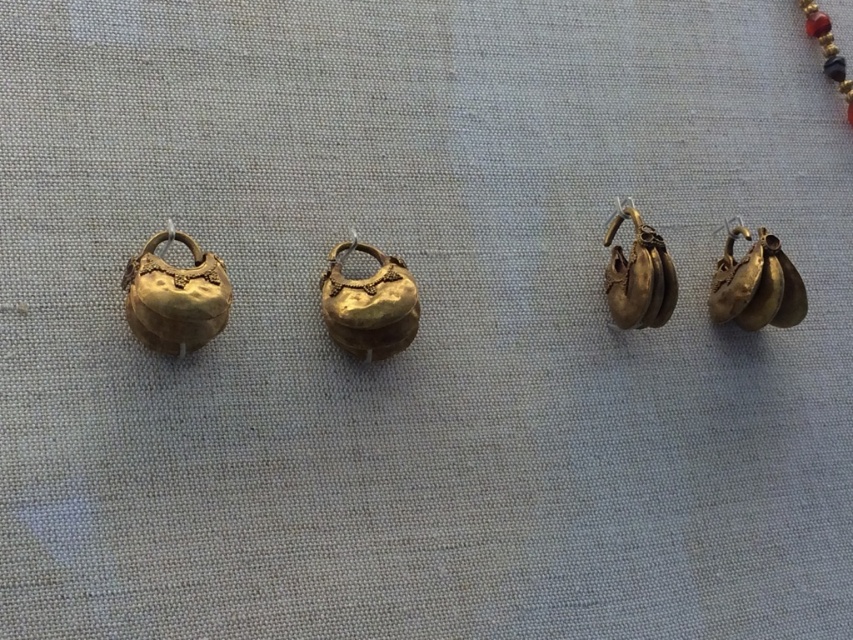
Question: Which object appears farthest from the camera in this image?

Choices:
 (A) gold beaded necklace at upper right
 (B) gold shiny earrings at right

Answer: (A)

Question: Does gold shiny bell at left have a greater width compared to gold beaded necklace at upper right?

Choices:
 (A) yes
 (B) no

Answer: (A)

Question: Is gold shiny bell at left to the right of gold shiny bell at center from the viewer's perspective?

Choices:
 (A) yes
 (B) no

Answer: (B)

Question: Among these points, which one is nearest to the camera?

Choices:
 (A) (815, 38)
 (B) (631, 305)
 (C) (381, 298)
 (D) (722, 298)

Answer: (C)

Question: Considering the real-world distances, which object is closest to the gold beaded necklace at upper right?

Choices:
 (A) gold shiny bell at left
 (B) gold/yellow metal/earrings at right

Answer: (B)

Question: Can you confirm if gold shiny earrings at right is positioned to the right of gold beaded necklace at upper right?

Choices:
 (A) yes
 (B) no

Answer: (B)